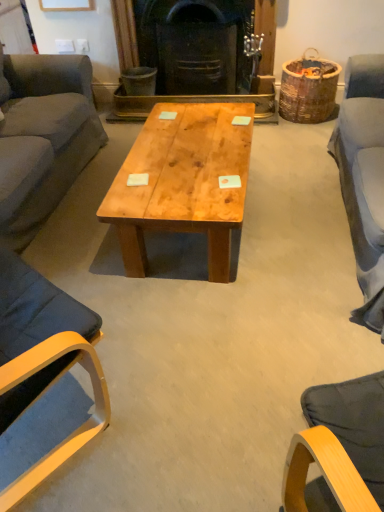
Question: From a real-world perspective, is black cast iron fireplace at center positioned over dark gray fabric couch at left based on gravity?

Choices:
 (A) no
 (B) yes

Answer: (A)

Question: Is black cast iron fireplace at center behind dark gray fabric couch at left?

Choices:
 (A) no
 (B) yes

Answer: (B)

Question: Is black cast iron fireplace at center located outside dark gray fabric couch at left?

Choices:
 (A) no
 (B) yes

Answer: (B)

Question: Considering the relative sizes of black cast iron fireplace at center and dark gray fabric couch at left in the image provided, is black cast iron fireplace at center bigger than dark gray fabric couch at left?

Choices:
 (A) no
 (B) yes

Answer: (A)

Question: From the image's perspective, is black cast iron fireplace at center beneath dark gray fabric couch at left?

Choices:
 (A) yes
 (B) no

Answer: (B)

Question: Is black cast iron fireplace at center positioned in front of dark gray fabric couch at left?

Choices:
 (A) yes
 (B) no

Answer: (B)

Question: Is dark gray fabric couch at left inside natural wood coffee table at center?

Choices:
 (A) no
 (B) yes

Answer: (A)

Question: From the image's perspective, is natural wood coffee table at center on dark gray fabric couch at left?

Choices:
 (A) yes
 (B) no

Answer: (B)

Question: Is natural wood coffee table at center at the left side of dark gray fabric couch at left?

Choices:
 (A) no
 (B) yes

Answer: (A)

Question: Can you confirm if natural wood coffee table at center is bigger than dark gray fabric couch at left?

Choices:
 (A) no
 (B) yes

Answer: (A)

Question: Is the position of natural wood coffee table at center less distant than that of dark gray fabric couch at left?

Choices:
 (A) yes
 (B) no

Answer: (B)

Question: Would you say natural wood coffee table at center is a long distance from dark gray fabric couch at left?

Choices:
 (A) yes
 (B) no

Answer: (B)

Question: Does matte wood chair at left appear on the left side of natural wood coffee table at center?

Choices:
 (A) yes
 (B) no

Answer: (A)